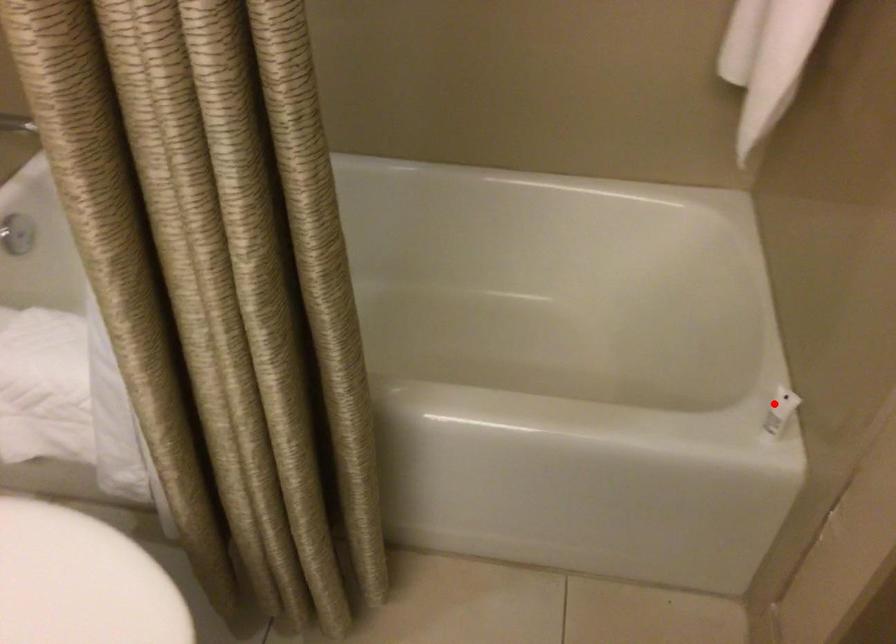
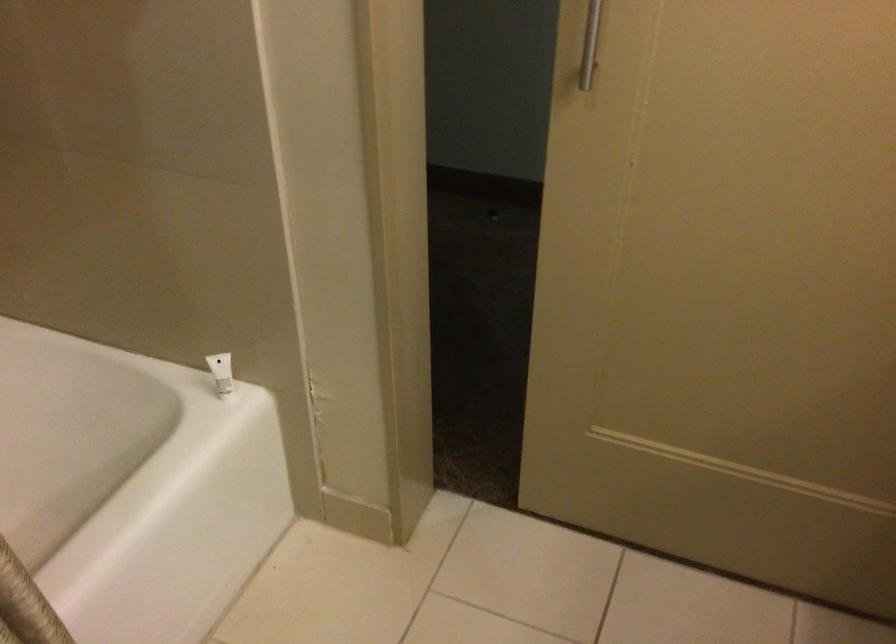
Question: I am providing you with two images of the same scene from different viewpoints. A red point is shown in image1. For the corresponding object point in image2, is it positioned nearer or farther from the camera?

Choices:
 (A) Nearer
 (B) Farther

Answer: (B)